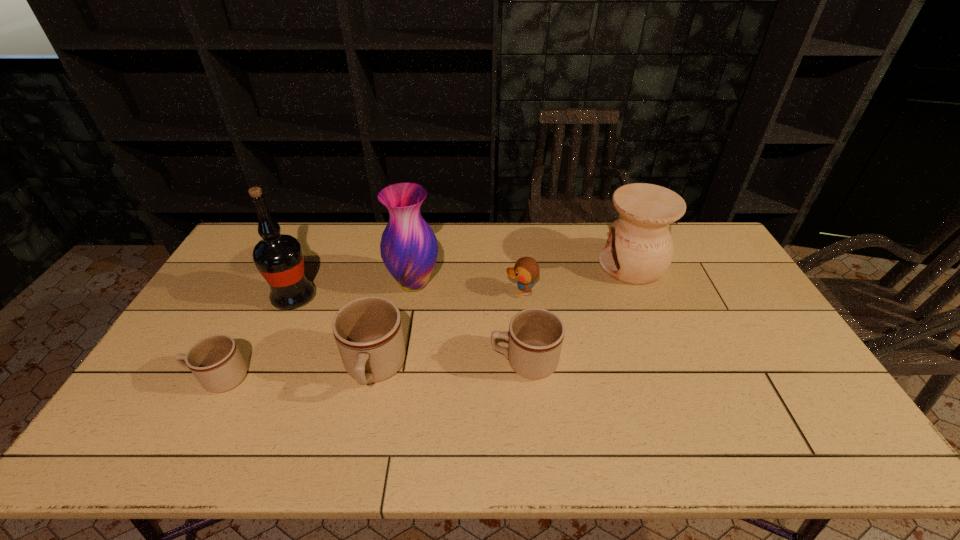
Please show where to add a mug on the right while keeping spacing even. Please provide its 2D coordinates. Your answer should be formatted as a tuple, i.e. [(x, y)], where the tuple contains the x and y coordinates of a point satisfying the conditions above.

[(669, 354)]